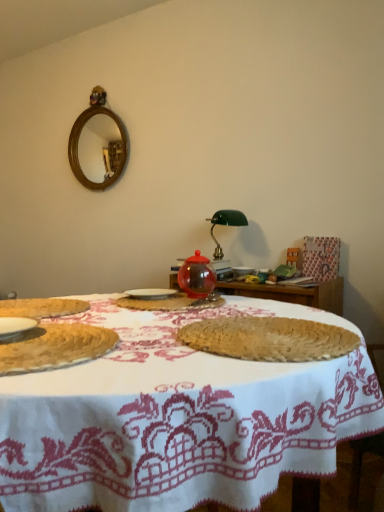
The height and width of the screenshot is (512, 384). I want to click on free point above transparent glass jar at center, which appears as the first food when viewed from the back (from a real-world perspective), so (167, 294).